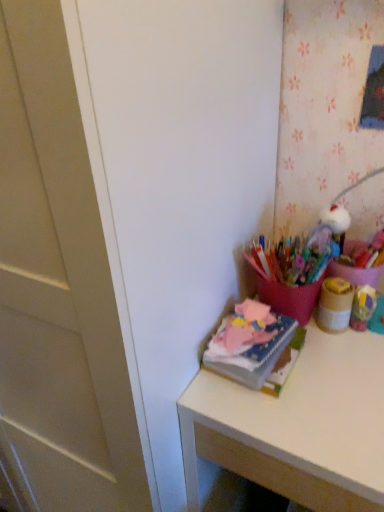
Identify the location of free spot in front of soft pink fabric at upper right. [x=287, y=419].